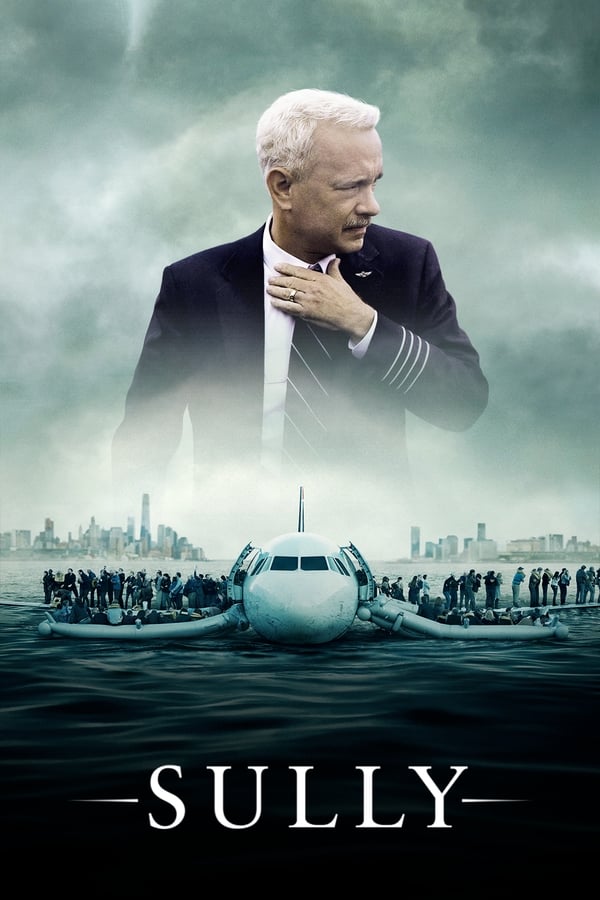
The image size is (600, 900). In order to click on doors left and right side in this screenshot , I will do `click(241, 554)`, `click(358, 554)`.